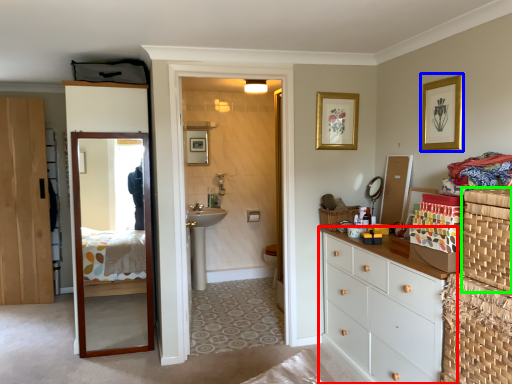
Question: Which object is positioned farthest from chest of drawers (highlighted by a red box)? Select from picture frame (highlighted by a blue box) and basket container (highlighted by a green box).

Choices:
 (A) picture frame
 (B) basket container

Answer: (A)